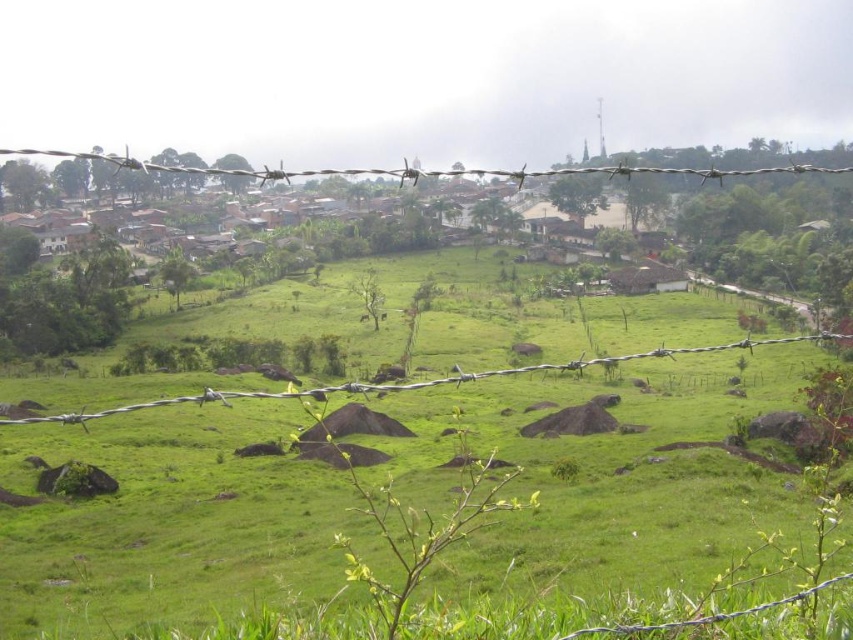
You are a drone operator flying over the rural landscape. You need to capture a photo of the green grassy field at center and the silver barbed wire at upper center. Which of these two objects will appear narrower in the photo?

The green grassy field at center will appear narrower in the photo because it has a lesser width compared to the silver barbed wire at upper center.

Based on the scene described, which object takes up more area in the image between the green grassy field at center and the silver barbed wire at upper center?

The silver barbed wire at upper center occupies more area than the green grassy field at center.